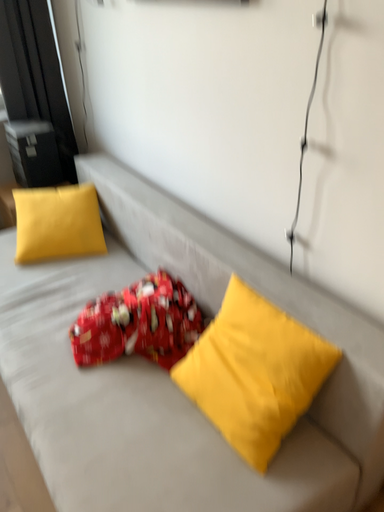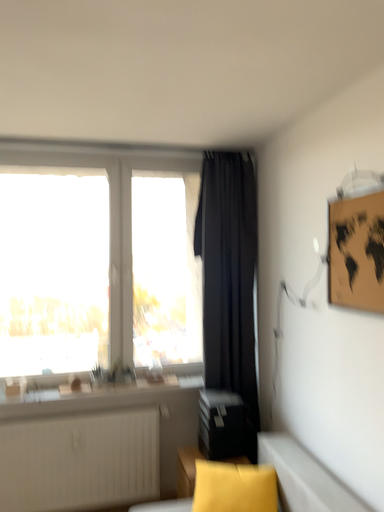
Question: How did the camera likely rotate when shooting the video?

Choices:
 (A) rotated left
 (B) rotated right

Answer: (A)